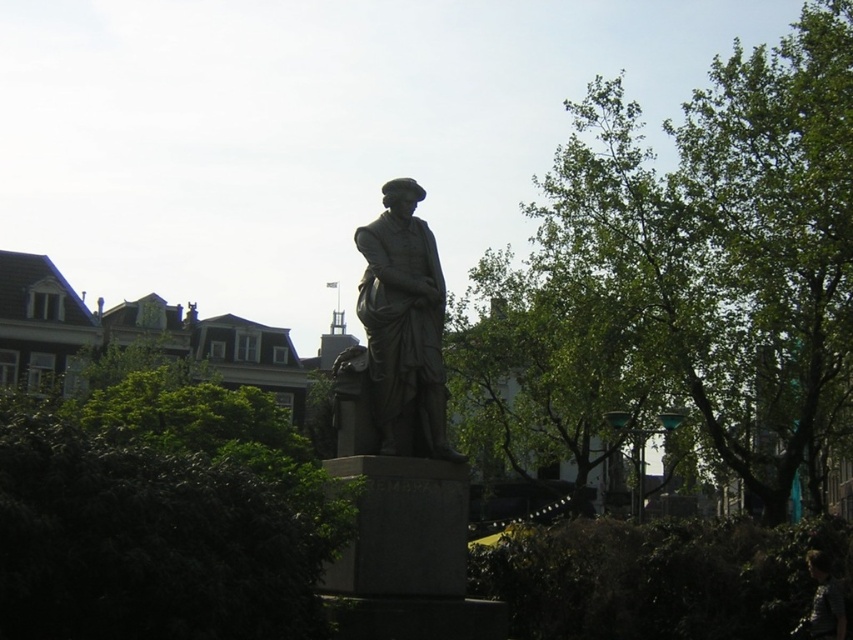
Question: Considering the real-world distances, which object is closest to the dark brown hair at lower right?

Choices:
 (A) green leafy tree at center
 (B) bronze statue at center
 (C) green leafy bush at center

Answer: (B)

Question: Does green leafy tree at center appear on the left side of green leafy bush at center?

Choices:
 (A) no
 (B) yes

Answer: (A)

Question: Which is farther from the green leafy tree at center?

Choices:
 (A) green leafy bush at center
 (B) bronze statue at center
 (C) dark brown hair at lower right

Answer: (C)

Question: Does green leafy tree at center appear on the right side of dark brown hair at lower right?

Choices:
 (A) no
 (B) yes

Answer: (B)

Question: Can you confirm if bronze statue at center is thinner than dark brown hair at lower right?

Choices:
 (A) yes
 (B) no

Answer: (B)

Question: Among these objects, which one is farthest from the camera?

Choices:
 (A) green leafy bush at center
 (B) green leafy tree at center
 (C) bronze statue at center

Answer: (B)